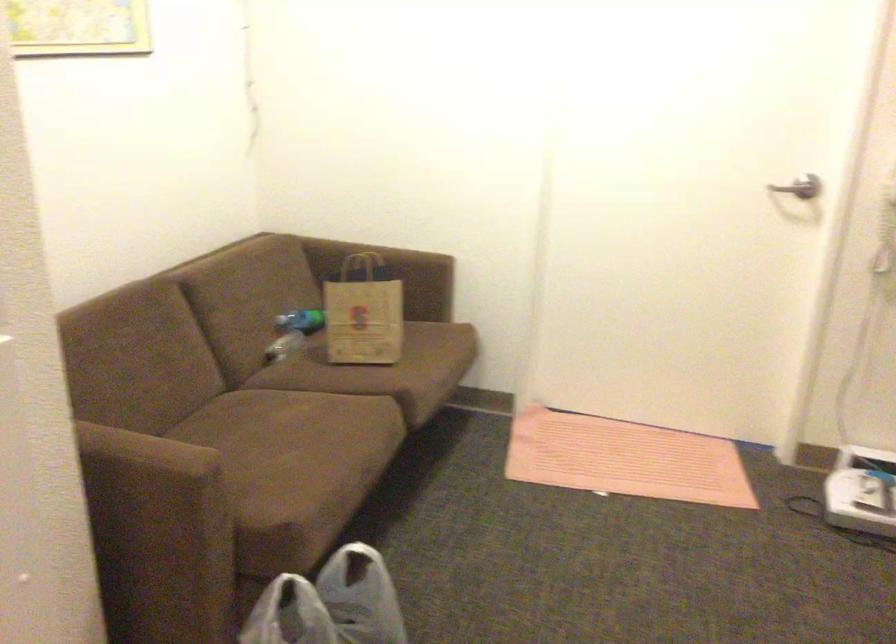
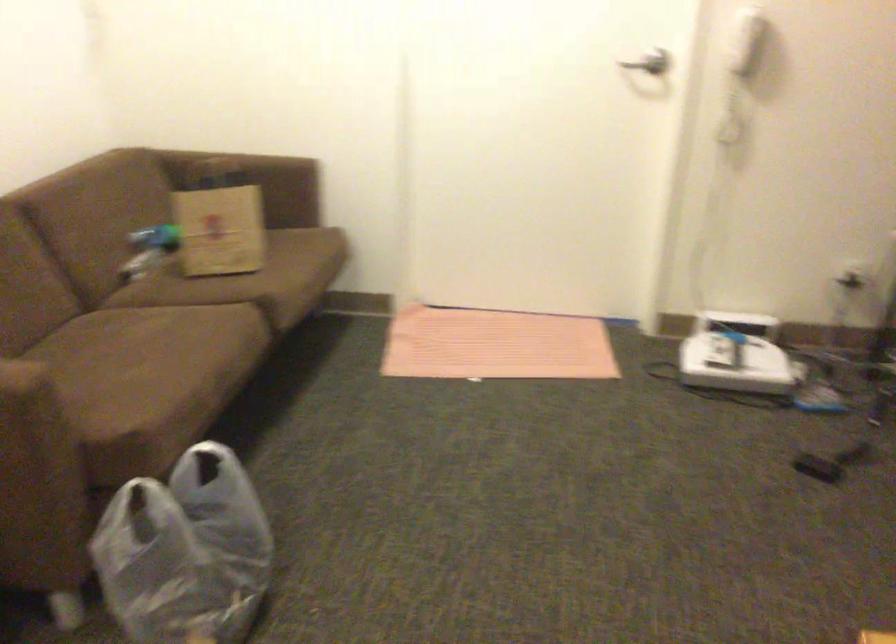
Where in the second image is the point corresponding to the point at 808,180 from the first image?

(650, 62)